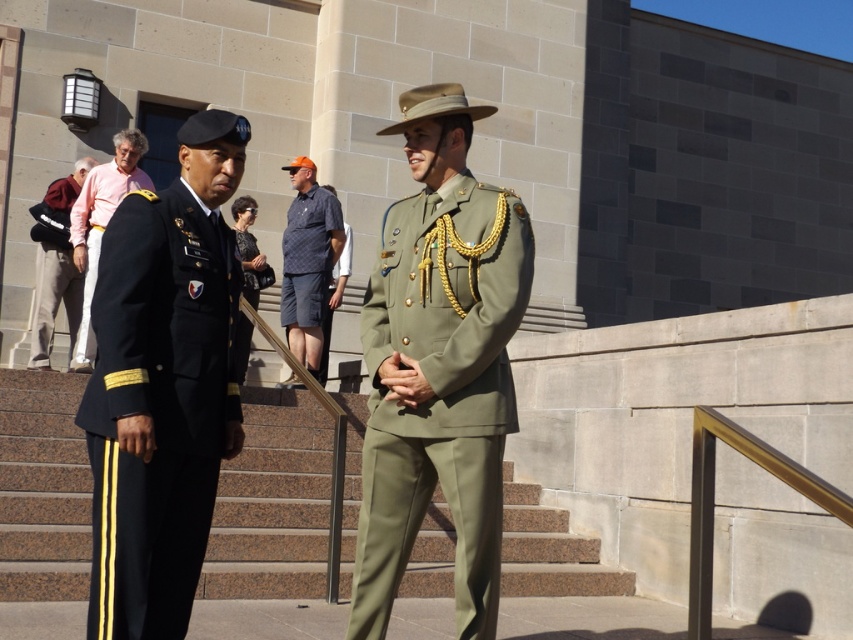
You are a photographer trying to capture a photo of the dark green fabric uniform at center and the brown stone stairs at center. Which object is located below the other in the image?

The brown stone stairs at center is positioned under the dark green fabric uniform at center, so the stairs are below the uniform in the image.